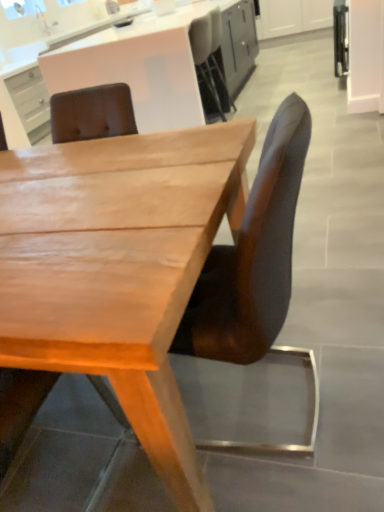
Question: Does matte white cabinet at upper center appear on the right side of brown leather chair at center, the 2th chair when ordered from left to right?

Choices:
 (A) yes
 (B) no

Answer: (B)

Question: Can you confirm if matte white cabinet at upper center is positioned to the left of brown leather chair at center, the 2th chair when ordered from left to right?

Choices:
 (A) yes
 (B) no

Answer: (A)

Question: Is matte white cabinet at upper center facing away from brown leather chair at center, arranged as the first chair when viewed from the right?

Choices:
 (A) yes
 (B) no

Answer: (B)

Question: Considering the relative sizes of matte white cabinet at upper center and brown leather chair at center, the 2th chair when ordered from left to right, in the image provided, is matte white cabinet at upper center smaller than brown leather chair at center, the 2th chair when ordered from left to right,?

Choices:
 (A) no
 (B) yes

Answer: (A)

Question: Does matte white cabinet at upper center lie behind brown leather chair at center, arranged as the first chair when viewed from the right?

Choices:
 (A) yes
 (B) no

Answer: (A)

Question: From the image's perspective, would you say matte white cabinet at upper center is shown under brown leather chair at center, the 2th chair when ordered from left to right?

Choices:
 (A) yes
 (B) no

Answer: (B)

Question: Is brown leather chair at center, arranged as the first chair when viewed from the right, behind light brown wood desk at center?

Choices:
 (A) no
 (B) yes

Answer: (B)

Question: From the image's perspective, is brown leather chair at center, arranged as the first chair when viewed from the right, below light brown wood desk at center?

Choices:
 (A) no
 (B) yes

Answer: (A)

Question: Is brown leather chair at center, the 2th chair when ordered from left to right, to the right of light brown wood desk at center from the viewer's perspective?

Choices:
 (A) yes
 (B) no

Answer: (A)

Question: Is brown leather chair at center, the 2th chair when ordered from left to right, facing away from light brown wood desk at center?

Choices:
 (A) no
 (B) yes

Answer: (B)

Question: From a real-world perspective, is brown leather chair at center, arranged as the first chair when viewed from the right, positioned over light brown wood desk at center based on gravity?

Choices:
 (A) no
 (B) yes

Answer: (B)

Question: Is brown leather chair at center, the 2th chair when ordered from left to right, taller than light brown wood desk at center?

Choices:
 (A) no
 (B) yes

Answer: (B)

Question: Does light brown wood desk at center turn towards brown leather chair at center, arranged as the first chair when viewed from the right?

Choices:
 (A) yes
 (B) no

Answer: (A)